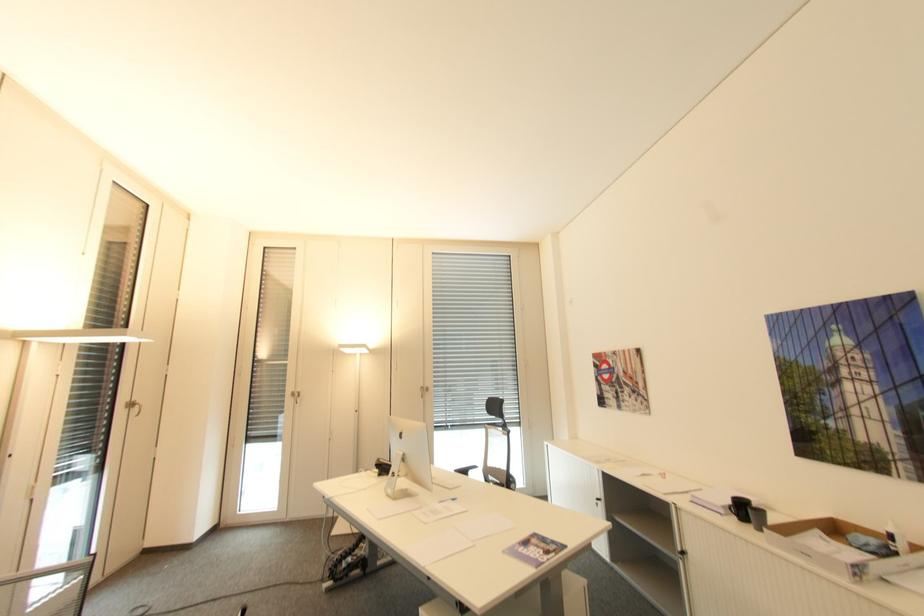
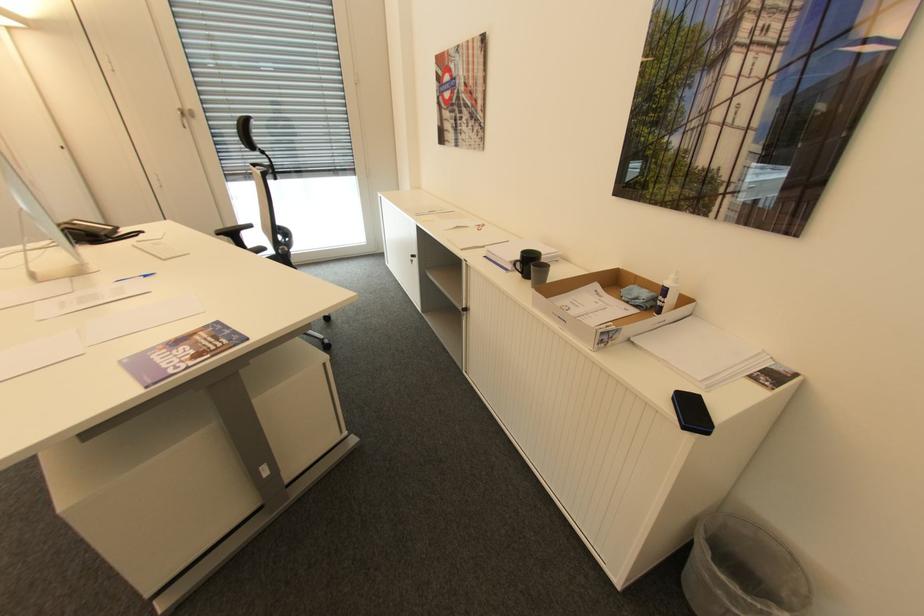
Where in the second image is the point corresponding to (457,500) from the first image?

(150, 276)